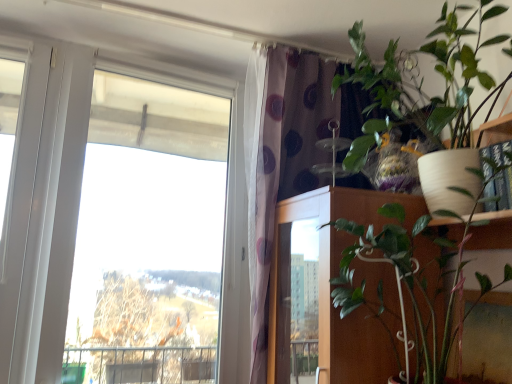
Question: Can you confirm if wooden door at center is shorter than purple dotted curtain at upper center?

Choices:
 (A) no
 (B) yes

Answer: (B)

Question: From the image's perspective, is wooden door at center located beneath purple dotted curtain at upper center?

Choices:
 (A) no
 (B) yes

Answer: (B)

Question: Considering the relative sizes of wooden door at center and purple dotted curtain at upper center in the image provided, is wooden door at center bigger than purple dotted curtain at upper center?

Choices:
 (A) no
 (B) yes

Answer: (A)

Question: Is wooden door at center smaller than purple dotted curtain at upper center?

Choices:
 (A) no
 (B) yes

Answer: (B)

Question: Considering the relative sizes of wooden door at center and purple dotted curtain at upper center in the image provided, is wooden door at center taller than purple dotted curtain at upper center?

Choices:
 (A) yes
 (B) no

Answer: (B)

Question: Would you say wooden door at center is outside purple dotted curtain at upper center?

Choices:
 (A) no
 (B) yes

Answer: (A)

Question: Is purple dotted curtain at upper center not close to white matte pot at upper right?

Choices:
 (A) no
 (B) yes

Answer: (A)

Question: Is white matte pot at upper right a part of purple dotted curtain at upper center?

Choices:
 (A) yes
 (B) no

Answer: (B)

Question: From the image's perspective, is purple dotted curtain at upper center under white matte pot at upper right?

Choices:
 (A) yes
 (B) no

Answer: (B)

Question: Can you confirm if purple dotted curtain at upper center is taller than white matte pot at upper right?

Choices:
 (A) yes
 (B) no

Answer: (A)

Question: From a real-world perspective, is purple dotted curtain at upper center under white matte pot at upper right?

Choices:
 (A) yes
 (B) no

Answer: (B)

Question: Considering the relative sizes of purple dotted curtain at upper center and white matte pot at upper right in the image provided, is purple dotted curtain at upper center shorter than white matte pot at upper right?

Choices:
 (A) yes
 (B) no

Answer: (B)

Question: Is wooden door at center at the back of purple dotted curtain at upper center?

Choices:
 (A) yes
 (B) no

Answer: (A)